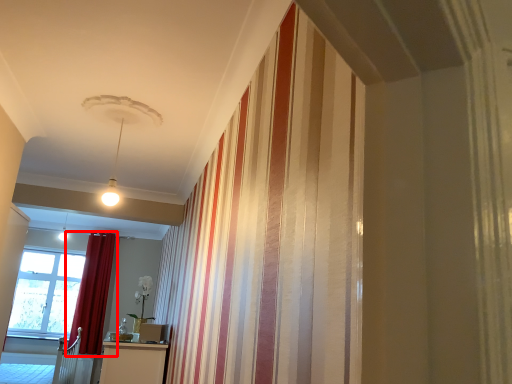
Question: In this image, where is curtain (annotated by the red box) located relative to window?

Choices:
 (A) right
 (B) left

Answer: (A)